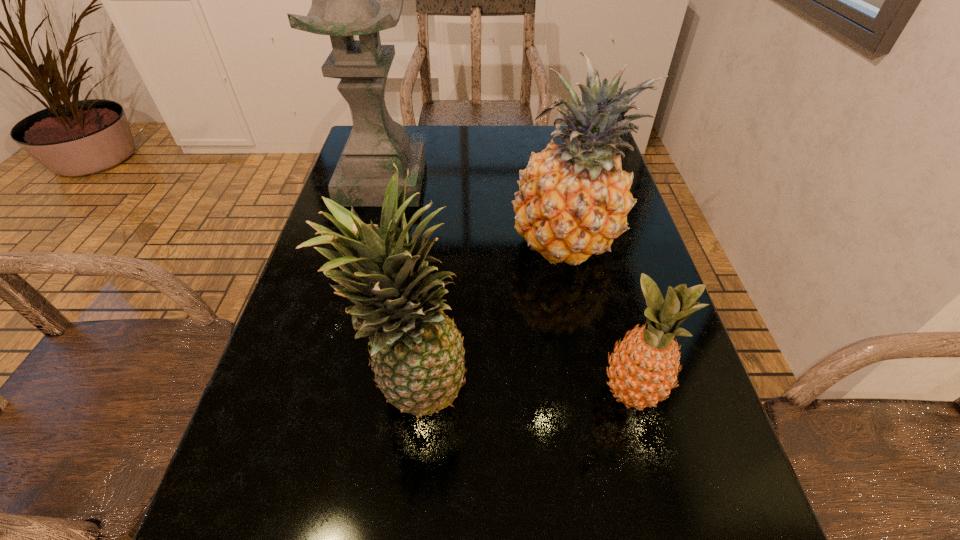
Image resolution: width=960 pixels, height=540 pixels. In order to click on sculpture at the left edge in this screenshot , I will do `click(344, 4)`.

Locate an element on the screen. Image resolution: width=960 pixels, height=540 pixels. pineapple at the left edge is located at coordinates (417, 353).

I want to click on object that is at the far left corner, so click(344, 4).

Find the location of `blank space at the far edge of the desktop`. blank space at the far edge of the desktop is located at coordinates (527, 153).

Locate an element on the screen. This screenshot has width=960, height=540. vacant space at the left edge of the desktop is located at coordinates (301, 301).

Where is `vacant space at the right edge of the desktop`? The width and height of the screenshot is (960, 540). vacant space at the right edge of the desktop is located at coordinates (646, 422).

Locate an element on the screen. vacant region between the shortest object and the farthest object is located at coordinates tap(507, 288).

In order to click on free area in between the shortest object and the leftmost pineapple in this screenshot , I will do `click(521, 391)`.

Locate an element on the screen. This screenshot has height=540, width=960. free space between the farthest object and the shortest pineapple is located at coordinates (507, 288).

Where is `vacant space that's between the third nearest object and the leftmost pineapple`? The height and width of the screenshot is (540, 960). vacant space that's between the third nearest object and the leftmost pineapple is located at coordinates (491, 317).